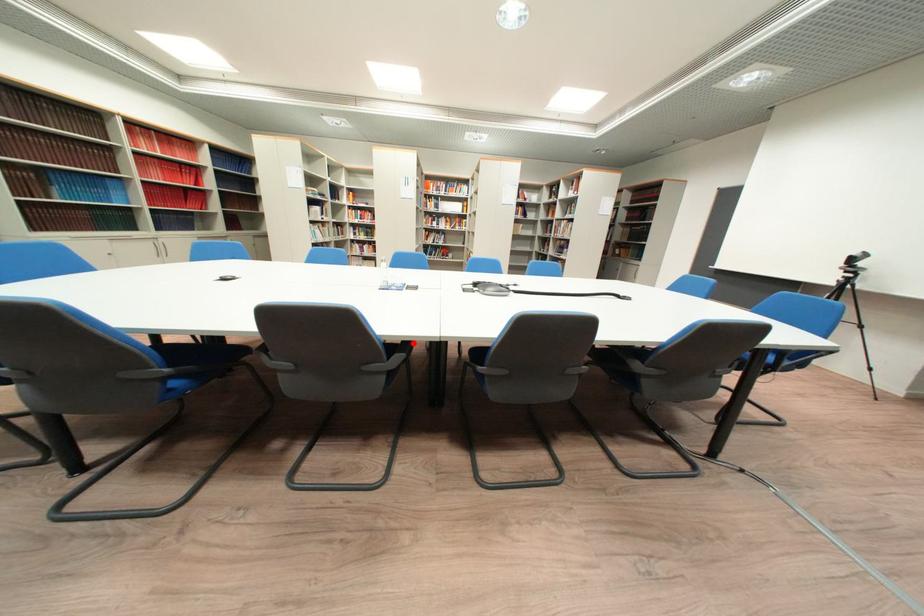
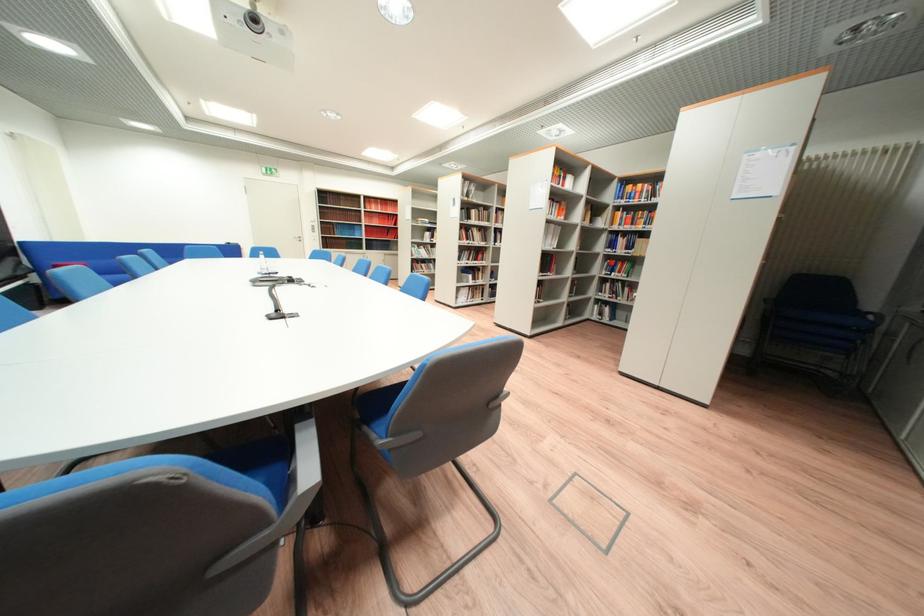
Question: I am providing you with two images of the same scene from different viewpoints. A red point is marked on the first image. Can you still see the location of the red point in image 2?

Choices:
 (A) Yes
 (B) No

Answer: (B)